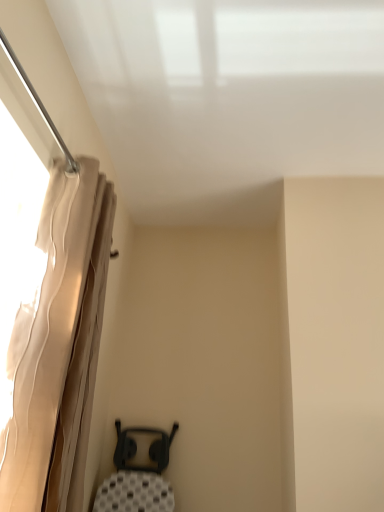
Identify the location of sheer beige curtain at left. (58, 347).

Image resolution: width=384 pixels, height=512 pixels. Describe the element at coordinates (58, 347) in the screenshot. I see `sheer beige curtain at left` at that location.

You are a GUI agent. You are given a task and a screenshot of the screen. Output one action in this format:
    pyautogui.click(x=<x>, y=<y>)
    Task: Click on the sheer beige curtain at left
    The height and width of the screenshot is (512, 384).
    Given the screenshot: What is the action you would take?
    (58, 347)